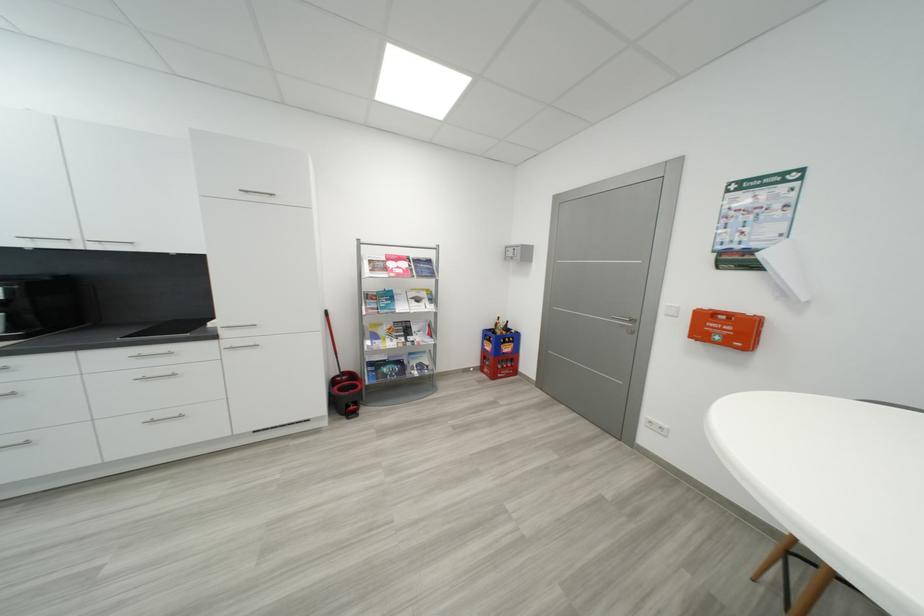
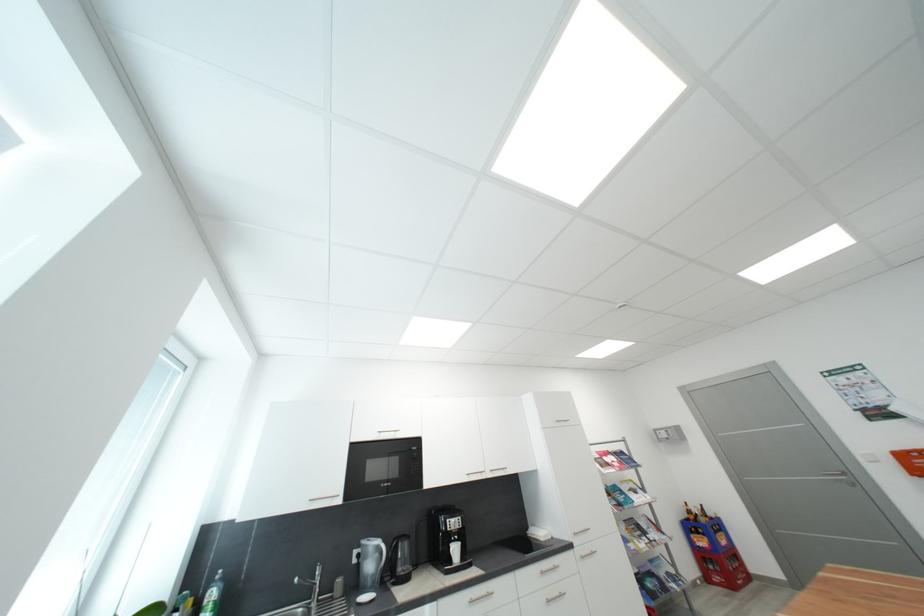
Where in the second image is the point corresponding to [505,334] from the first image?

(710, 522)